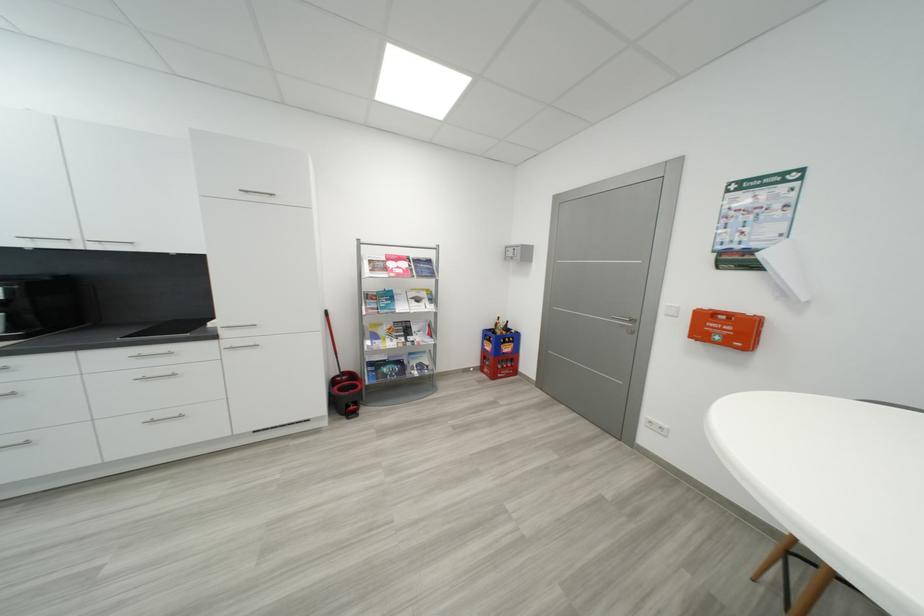
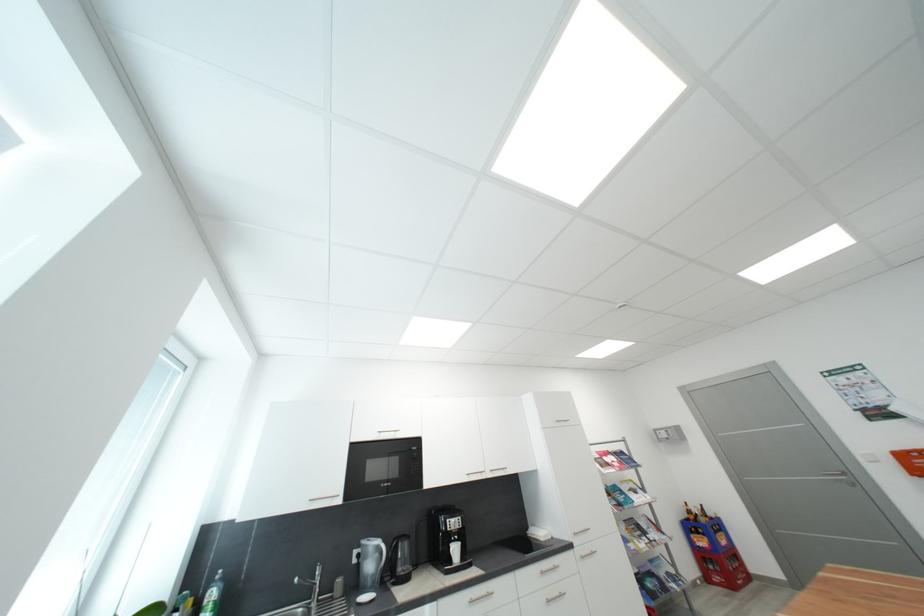
Where in the second image is the point corresponding to [505,334] from the first image?

(710, 522)